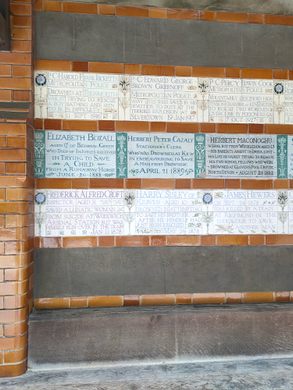
Locate an element on the screen. column is located at coordinates (39, 155), (119, 154), (200, 153), (283, 161).